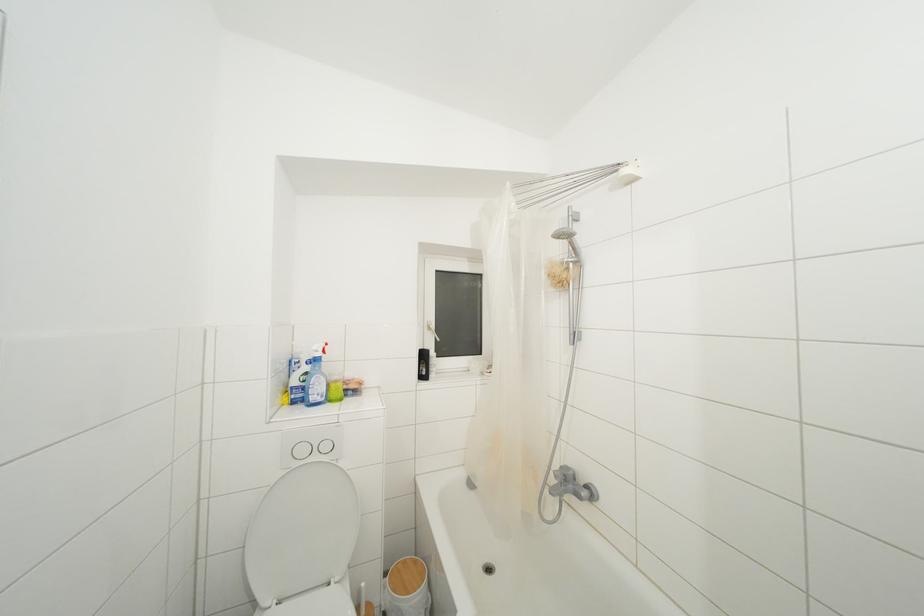
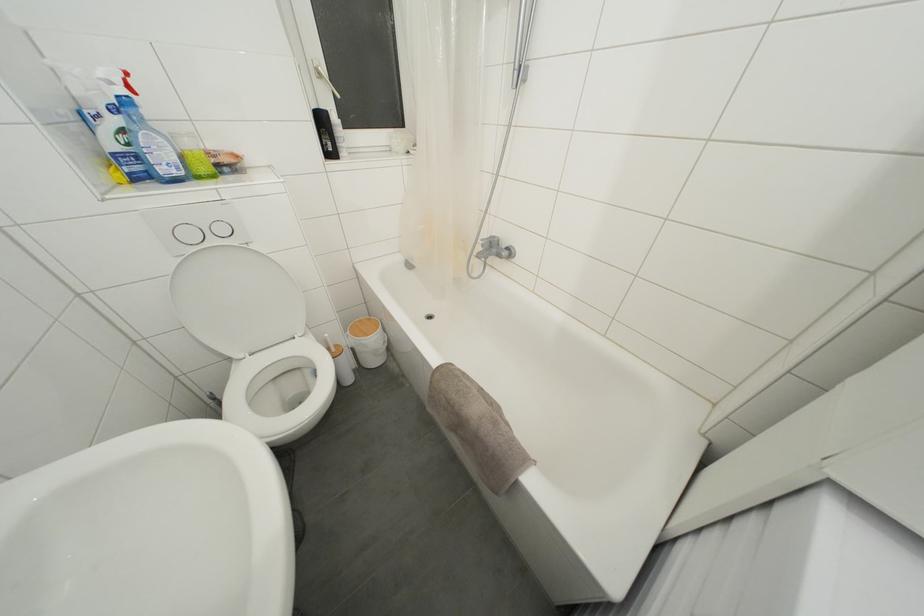
Find the pixel in the second image that matches point 408,567 in the first image.

(363, 326)